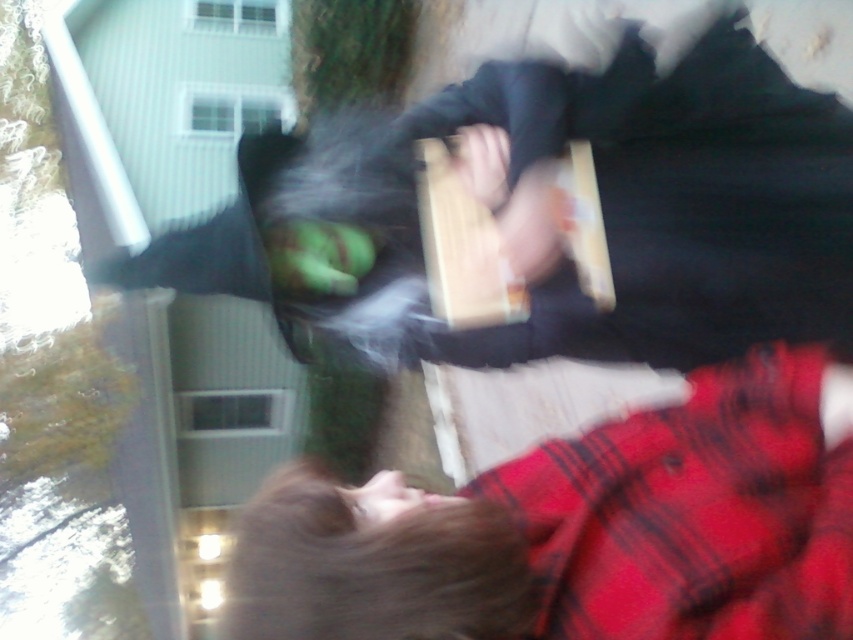
Who is higher up, matte black jacket at upper center or flannel shirt at lower right?

→ matte black jacket at upper center is higher up.

Is matte black jacket at upper center shorter than flannel shirt at lower right?

No.

Locate an element on the screen. matte black jacket at upper center is located at coordinates (550, 211).

Locate an element on the screen. matte black jacket at upper center is located at coordinates (550, 211).